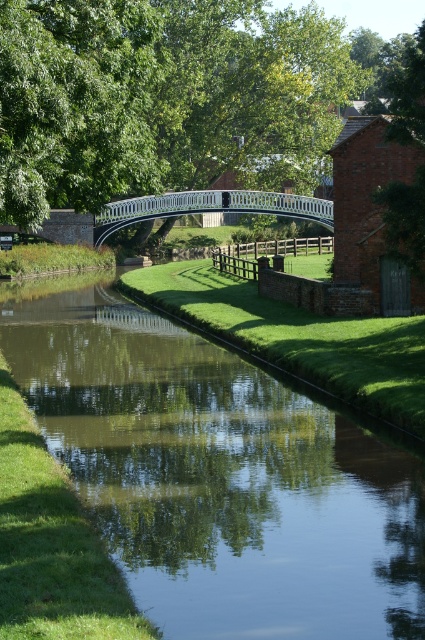
Question: Can you confirm if green grassy bank at center is bigger than white glossy bridge at center?

Choices:
 (A) no
 (B) yes

Answer: (A)

Question: Can you confirm if green grassy bank at center is thinner than white glossy bridge at center?

Choices:
 (A) no
 (B) yes

Answer: (B)

Question: Which of the following is the farthest from the observer?

Choices:
 (A) (79, 384)
 (B) (118, 218)

Answer: (B)

Question: Can you confirm if green grassy bank at center is smaller than white glossy bridge at center?

Choices:
 (A) no
 (B) yes

Answer: (B)

Question: Among these points, which one is farthest from the camera?

Choices:
 (A) (121, 202)
 (B) (107, 320)

Answer: (A)